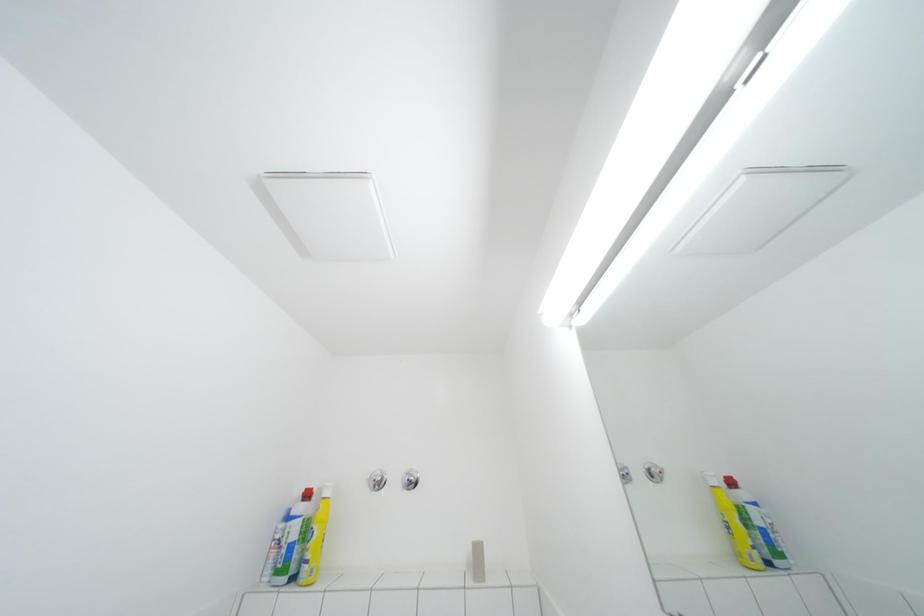
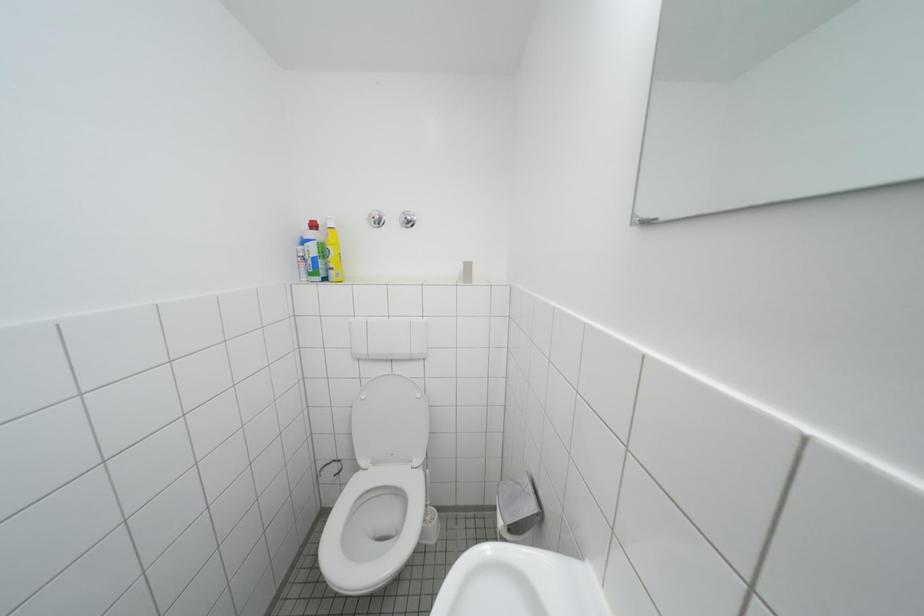
Question: Based on the continuous images, in which direction is the camera rotating? Reply with the corresponding letter.

Choices:
 (A) Left
 (B) Right
 (C) Up
 (D) Down

Answer: (D)